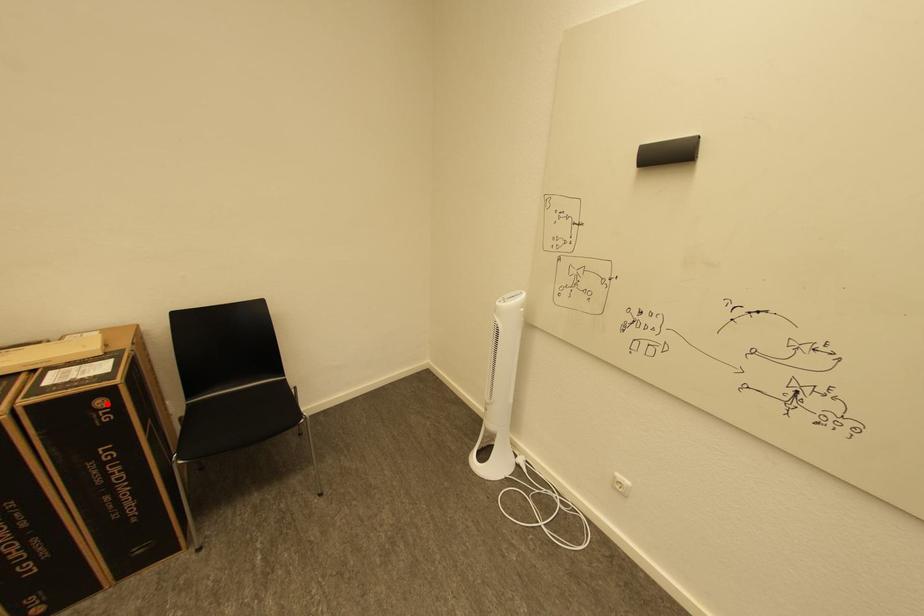
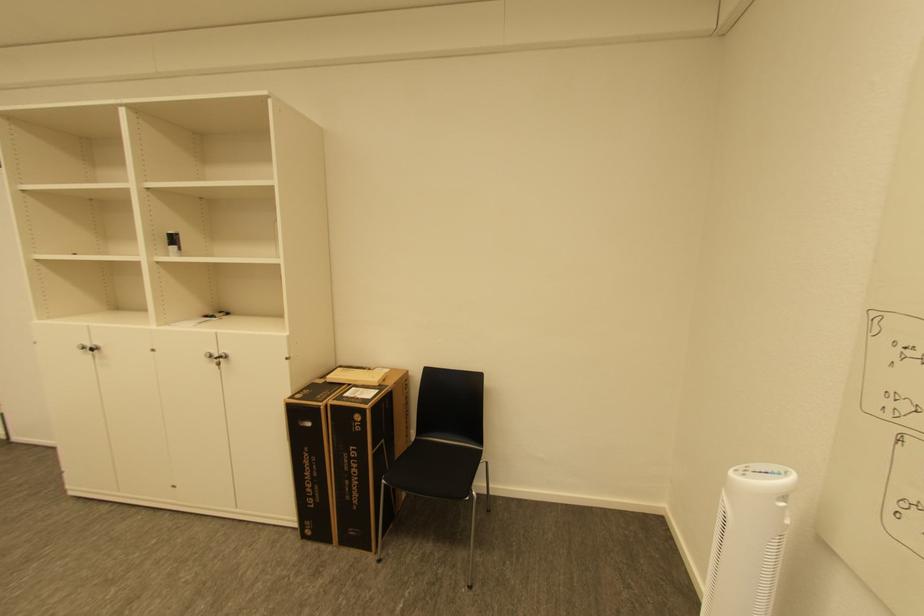
Where in the second image is the point corresponding to the highlighted location from the first image?

(363, 418)